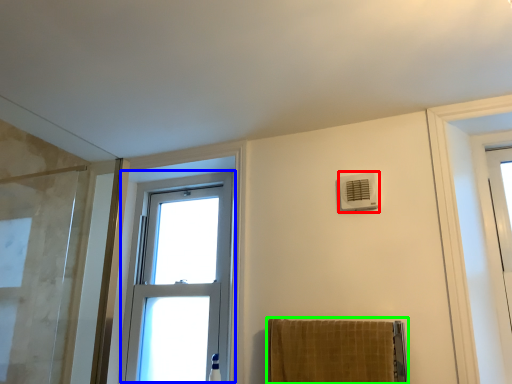
Question: Considering the real-world distances, which object is farthest from air conditioning (highlighted by a red box)? window (highlighted by a blue box) or towel (highlighted by a green box)?

Choices:
 (A) window
 (B) towel

Answer: (A)